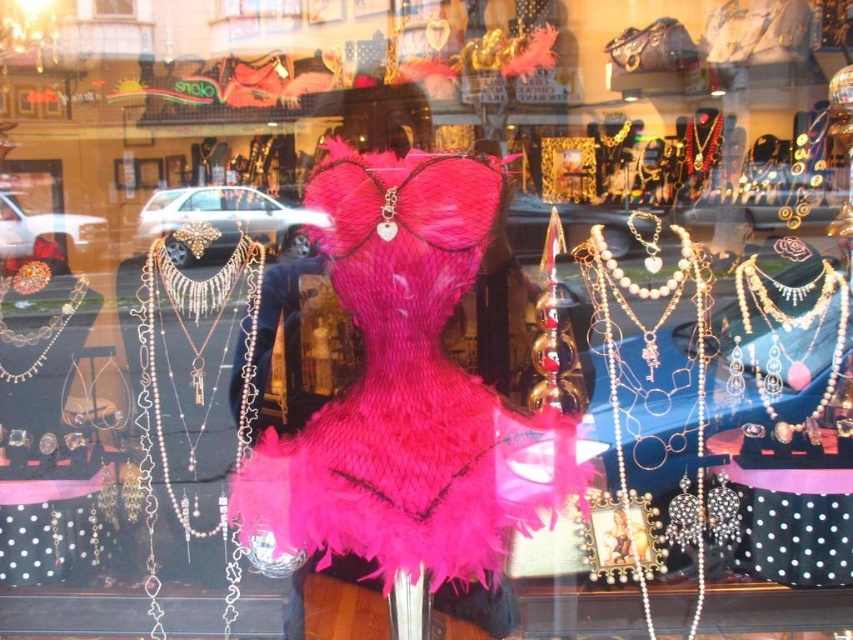
Question: Estimate the real-world distances between objects in this image. Which object is farther from the pearl/textured necklace at left?

Choices:
 (A) silver metallic chain at left
 (B) fuzzy pink dress at center
 (C) pearl/pearly white necklace at center right

Answer: (C)

Question: Considering the real-world distances, which object is farthest from the pearl/textured necklace at left?

Choices:
 (A) silver metallic chain at left
 (B) pearl/pearly white necklace at center right
 (C) fuzzy pink dress at center

Answer: (B)

Question: Among these objects, which one is farthest from the camera?

Choices:
 (A) pearl/pearly white necklace at center right
 (B) pearl/textured necklace at left
 (C) fuzzy pink dress at center

Answer: (B)

Question: Is fuzzy pink dress at center positioned before silver metallic chain at left?

Choices:
 (A) no
 (B) yes

Answer: (B)

Question: Does fuzzy pink dress at center have a greater width compared to pearl/textured necklace at left?

Choices:
 (A) yes
 (B) no

Answer: (A)

Question: Is fuzzy pink dress at center thinner than pearl/textured necklace at left?

Choices:
 (A) no
 (B) yes

Answer: (A)